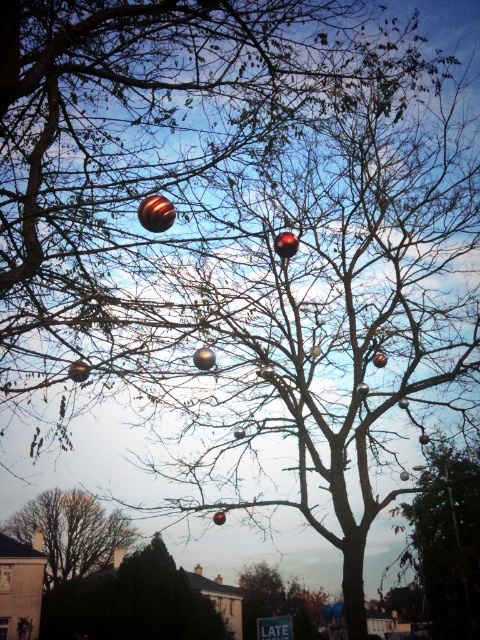
Question: Which point appears farthest from the camera in this image?

Choices:
 (A) (469, 566)
 (B) (11, 522)
 (C) (51, 128)

Answer: (B)

Question: Which object appears farthest from the camera in this image?

Choices:
 (A) metallic silver ornament at right
 (B) smooth brown tree at lower left

Answer: (B)

Question: Does metallic reflective ornaments at center appear over metallic silver ornament at right?

Choices:
 (A) no
 (B) yes

Answer: (B)

Question: Where is metallic reflective ornaments at center located in relation to metallic silver ornament at right in the image?

Choices:
 (A) right
 (B) left

Answer: (B)

Question: Which point is closer to the camera taking this photo?

Choices:
 (A) (217, 140)
 (B) (75, 500)

Answer: (A)

Question: Does metallic reflective ornaments at center appear on the left side of smooth brown tree at lower left?

Choices:
 (A) yes
 (B) no

Answer: (B)